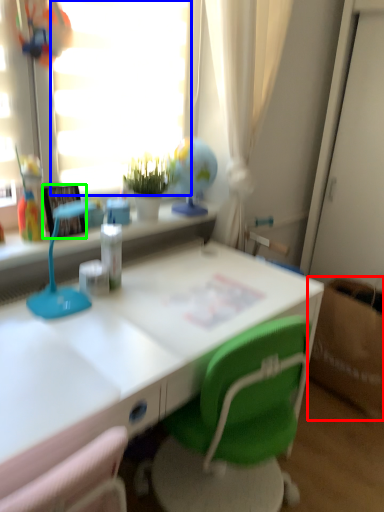
Question: Which is farther away from cardboard box (highlighted by a red box)? window screen (highlighted by a blue box) or picture frame (highlighted by a green box)?

Choices:
 (A) window screen
 (B) picture frame

Answer: (B)